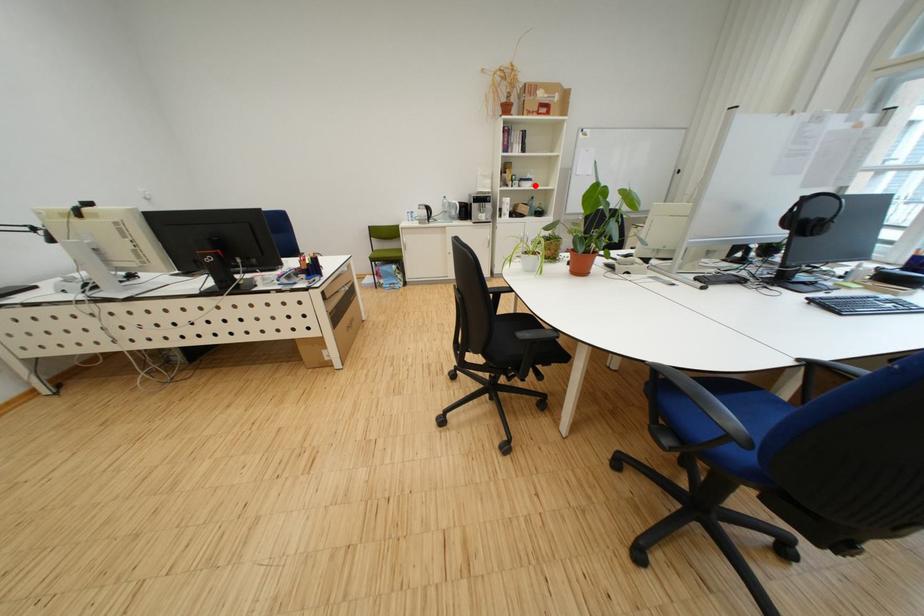
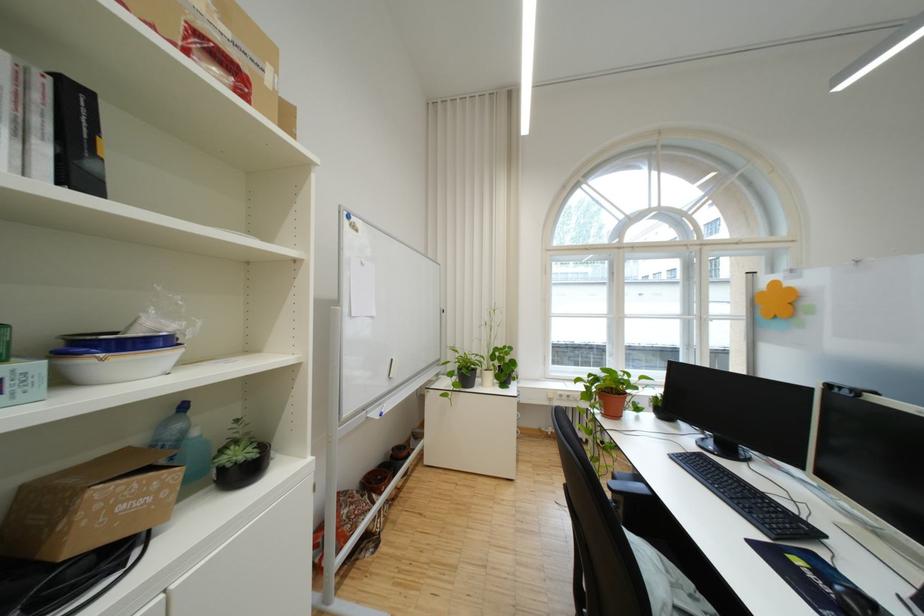
Where in the second image is the point corresponding to the highlighted location from the first image?

(117, 365)